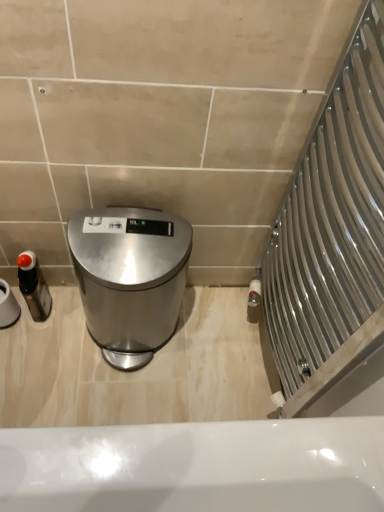
Question: Is white matte toilet paper at left surrounding matte black bottle at left?

Choices:
 (A) no
 (B) yes

Answer: (A)

Question: From a real-world perspective, is white matte toilet paper at left below matte black bottle at left?

Choices:
 (A) yes
 (B) no

Answer: (B)

Question: Is white matte toilet paper at left at the left side of matte black bottle at left?

Choices:
 (A) yes
 (B) no

Answer: (A)

Question: Is white matte toilet paper at left next to matte black bottle at left and touching it?

Choices:
 (A) no
 (B) yes

Answer: (B)

Question: Considering the relative sizes of white matte toilet paper at left and matte black bottle at left in the image provided, is white matte toilet paper at left smaller than matte black bottle at left?

Choices:
 (A) no
 (B) yes

Answer: (A)

Question: Can you confirm if white matte toilet paper at left is taller than matte black bottle at left?

Choices:
 (A) no
 (B) yes

Answer: (B)

Question: Is matte black bottle at left thinner than white matte toilet paper at left?

Choices:
 (A) no
 (B) yes

Answer: (B)

Question: Is matte black bottle at left with white matte toilet paper at left?

Choices:
 (A) yes
 (B) no

Answer: (A)

Question: Is white matte toilet paper at left at the back of matte black bottle at left?

Choices:
 (A) no
 (B) yes

Answer: (A)

Question: From the image's perspective, is matte black bottle at left located above white matte toilet paper at left?

Choices:
 (A) no
 (B) yes

Answer: (A)

Question: Can you confirm if matte black bottle at left is bigger than white matte toilet paper at left?

Choices:
 (A) yes
 (B) no

Answer: (B)

Question: Is matte black bottle at left at the right side of white matte toilet paper at left?

Choices:
 (A) no
 (B) yes

Answer: (B)

Question: Is satin silver trash can at center smaller than white matte toilet paper at left?

Choices:
 (A) no
 (B) yes

Answer: (A)